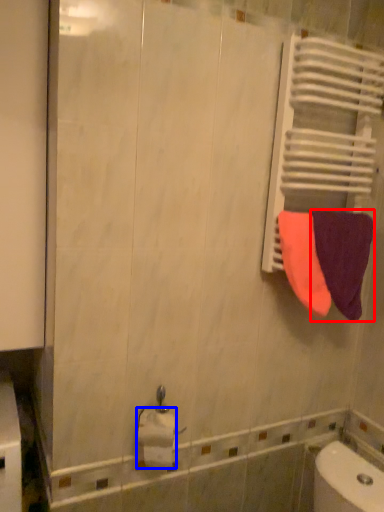
Question: Which object appears closest to the camera in this image, towel (highlighted by a red box) or toilet paper (highlighted by a blue box)?

Choices:
 (A) towel
 (B) toilet paper

Answer: (B)